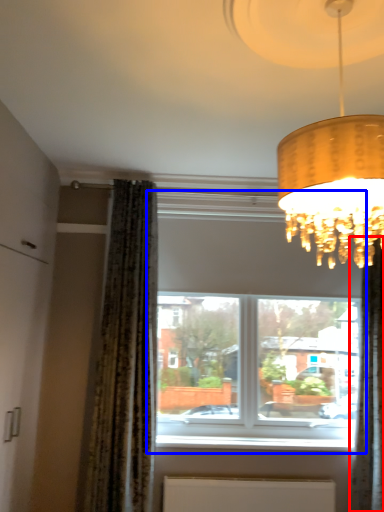
Question: Which object is further to the camera taking this photo, curtain (highlighted by a red box) or window (highlighted by a blue box)?

Choices:
 (A) curtain
 (B) window

Answer: (B)